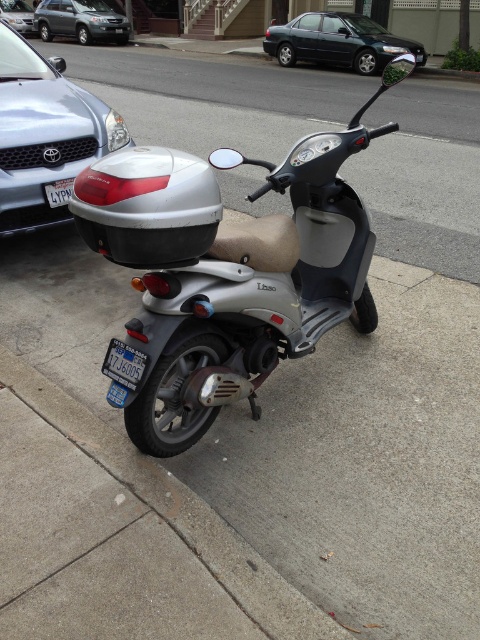
Question: Considering the real-world distances, which object is farthest from the silver metallic scooter at center?

Choices:
 (A) white plastic license plate at center
 (B) metallic silver sedan at left
 (C) silver metallic suv at upper left
 (D) metallic blue sedan at center

Answer: (C)

Question: Does metallic silver sedan at left appear on the left side of white plastic license plate at center?

Choices:
 (A) yes
 (B) no

Answer: (A)

Question: Does silver metallic scooter at center have a smaller size compared to metallic silver sedan at left?

Choices:
 (A) yes
 (B) no

Answer: (A)

Question: Can you confirm if metallic blue sedan at center is bigger than silver metallic sedan at upper left?

Choices:
 (A) yes
 (B) no

Answer: (A)

Question: Which object appears farthest from the camera in this image?

Choices:
 (A) metallic blue sedan at center
 (B) silver metallic suv at upper left
 (C) silver metallic sedan at upper left

Answer: (C)

Question: Estimate the real-world distances between objects in this image. Which object is closer to the silver metallic scooter at center?

Choices:
 (A) metallic silver sedan at left
 (B) silver metallic suv at upper left
 (C) silver metallic sedan at upper left
 (D) blue metallic license plate at lower center

Answer: (D)